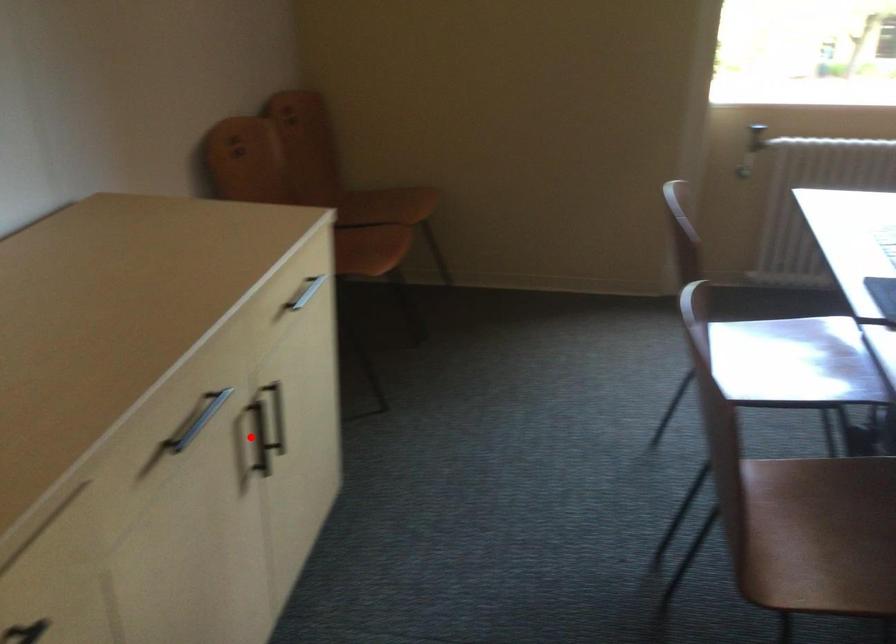
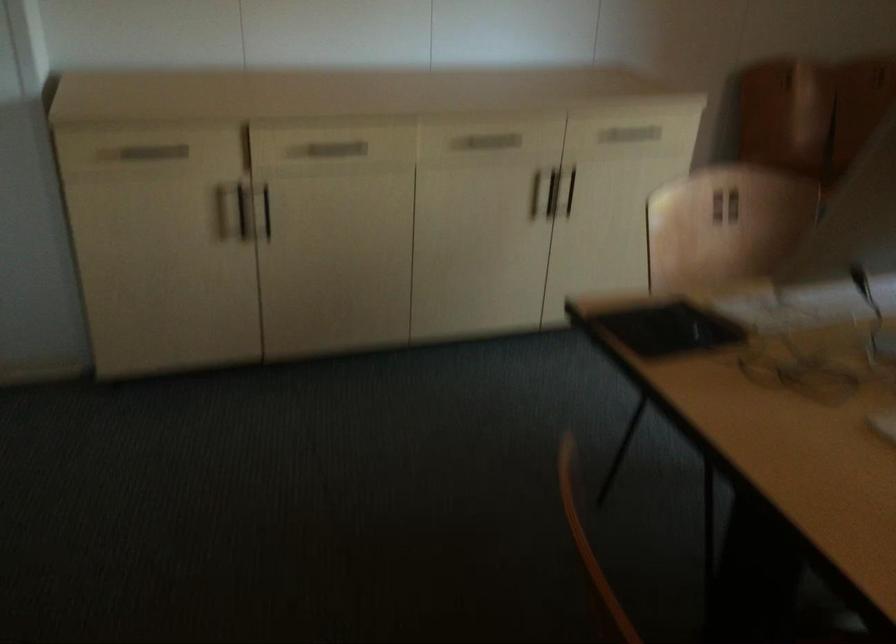
Question: I am providing you with two images of the same scene from different viewpoints. A red point is shown in image1. For the corresponding object point in image2, is it positioned nearer or farther from the camera?

Choices:
 (A) Nearer
 (B) Farther

Answer: (B)